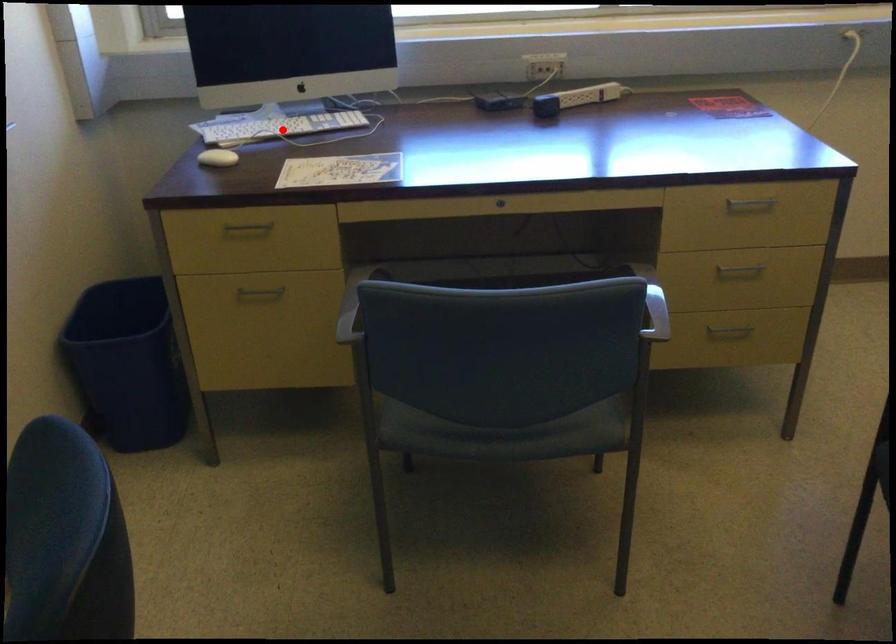
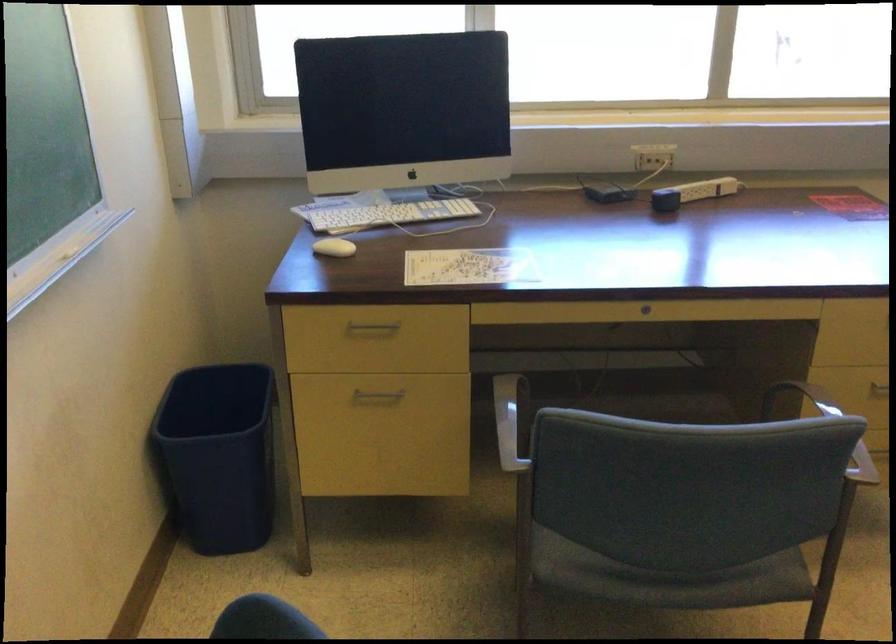
Where in the second image is the point corresponding to the highlighted location from the first image?

(389, 214)